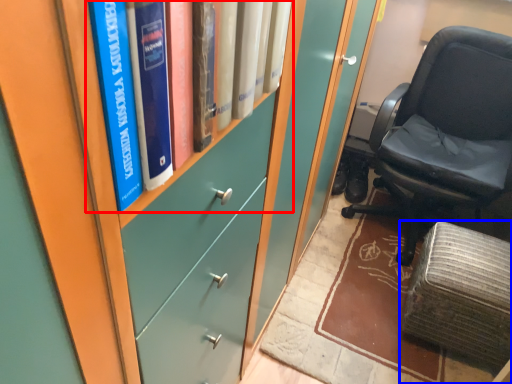
Question: Which object is closer to the camera taking this photo, book (highlighted by a red box) or furniture (highlighted by a blue box)?

Choices:
 (A) book
 (B) furniture

Answer: (A)